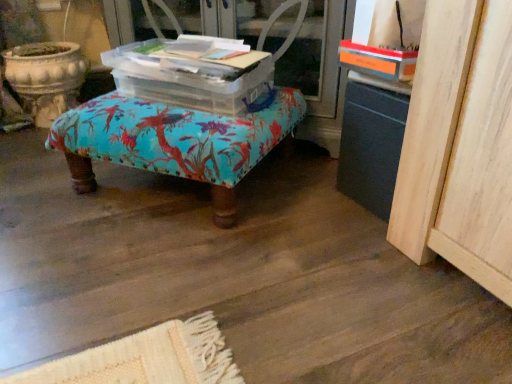
Image resolution: width=512 pixels, height=384 pixels. Describe the element at coordinates (190, 77) in the screenshot. I see `transparent plastic storage box at center` at that location.

Find the location of a particular element. transparent plastic screen door at center is located at coordinates (304, 49).

Considering the relative sizes of turquoise fabric ottoman at center and transparent plastic storage box at center in the image provided, is turquoise fabric ottoman at center shorter than transparent plastic storage box at center?

In fact, turquoise fabric ottoman at center may be taller than transparent plastic storage box at center.

Is transparent plastic storage box at center inside turquoise fabric ottoman at center?

No.

Is turquoise fabric ottoman at center positioned in front of transparent plastic storage box at center?

Yes, the depth of turquoise fabric ottoman at center is less than that of transparent plastic storage box at center.

Is turquoise fabric ottoman at center smaller than transparent plastic storage box at center?

Actually, turquoise fabric ottoman at center might be larger than transparent plastic storage box at center.

From a real-world perspective, is transparent plastic storage box at center below turquoise fabric ottoman at center?

No, from a real-world perspective, transparent plastic storage box at center is not beneath turquoise fabric ottoman at center.

Can you confirm if transparent plastic storage box at center is wider than turquoise fabric ottoman at center?

Incorrect, the width of transparent plastic storage box at center does not surpass that of turquoise fabric ottoman at center.

Is transparent plastic storage box at center at the left side of turquoise fabric ottoman at center?

Incorrect, transparent plastic storage box at center is not on the left side of turquoise fabric ottoman at center.

How much distance is there between transparent plastic storage box at center and turquoise fabric ottoman at center?

transparent plastic storage box at center and turquoise fabric ottoman at center are 4.50 inches apart.

Is transparent plastic screen door at center inside or outside of turquoise fabric ottoman at center?

transparent plastic screen door at center is located beyond the bounds of turquoise fabric ottoman at center.

Between transparent plastic screen door at center and turquoise fabric ottoman at center, which one has smaller width?

With smaller width is transparent plastic screen door at center.

Is transparent plastic screen door at center looking in the opposite direction of turquoise fabric ottoman at center?

No.

From the image's perspective, between transparent plastic screen door at center and transparent plastic storage box at center, who is located below?

transparent plastic storage box at center.

Which object is wider, transparent plastic screen door at center or transparent plastic storage box at center?

Wider between the two is transparent plastic screen door at center.

From a real-world perspective, which object stands above the other?

In real-world perspective, transparent plastic storage box at center is above.

Would you consider turquoise fabric ottoman at center to be distant from transparent plastic screen door at center?

No, turquoise fabric ottoman at center is not far from transparent plastic screen door at center.

Considering the positions of objects turquoise fabric ottoman at center and transparent plastic screen door at center in the image provided, who is in front, turquoise fabric ottoman at center or transparent plastic screen door at center?

turquoise fabric ottoman at center is closer to the camera.

In the image, there is a transparent plastic screen door at center. Where is `furniture below it (from the image's perspective)`? This screenshot has width=512, height=384. furniture below it (from the image's perspective) is located at coordinates (174, 141).

Considering the sizes of objects turquoise fabric ottoman at center and transparent plastic screen door at center in the image provided, who is thinner, turquoise fabric ottoman at center or transparent plastic screen door at center?

transparent plastic screen door at center is thinner.

Considering the positions of points (203, 74) and (327, 7), is point (203, 74) closer to camera compared to point (327, 7)?

Yes, point (203, 74) is closer to viewer.

Is transparent plastic storage box at center shorter than transparent plastic screen door at center?

Indeed, transparent plastic storage box at center has a lesser height compared to transparent plastic screen door at center.

Is transparent plastic storage box at center aimed at transparent plastic screen door at center?

No, transparent plastic storage box at center is not turned towards transparent plastic screen door at center.

Would you say transparent plastic storage box at center is outside transparent plastic screen door at center?

Yes, transparent plastic storage box at center is not within transparent plastic screen door at center.

Where is `storage box that is behind the turquoise fabric ottoman at center`? This screenshot has height=384, width=512. storage box that is behind the turquoise fabric ottoman at center is located at coordinates (190, 77).

Identify the location of storage box above the turquoise fabric ottoman at center (from a real-world perspective). This screenshot has width=512, height=384. (190, 77).

Estimate the real-world distances between objects in this image. Which object is closer to transparent plastic screen door at center, turquoise fabric ottoman at center or transparent plastic storage box at center?

Among the two, transparent plastic storage box at center is located nearer to transparent plastic screen door at center.

Based on the photo, from the image, which object appears to be farther from transparent plastic storage box at center, transparent plastic screen door at center or turquoise fabric ottoman at center?

The object further to transparent plastic storage box at center is transparent plastic screen door at center.

Estimate the real-world distances between objects in this image. Which object is further from transparent plastic screen door at center, transparent plastic storage box at center or turquoise fabric ottoman at center?

Based on the image, turquoise fabric ottoman at center appears to be further to transparent plastic screen door at center.

When comparing their distances from turquoise fabric ottoman at center, does transparent plastic storage box at center or transparent plastic screen door at center seem closer?

Based on the image, transparent plastic storage box at center appears to be nearer to turquoise fabric ottoman at center.

Consider the image. Looking at the image, which one is located closer to turquoise fabric ottoman at center, transparent plastic screen door at center or transparent plastic storage box at center?

The object closer to turquoise fabric ottoman at center is transparent plastic storage box at center.

In the scene shown: Based on their spatial positions, is turquoise fabric ottoman at center or transparent plastic screen door at center closer to transparent plastic storage box at center?

turquoise fabric ottoman at center.

Find the location of a particular element. The image size is (512, 384). storage box between transparent plastic screen door at center and turquoise fabric ottoman at center vertically is located at coordinates pos(190,77).